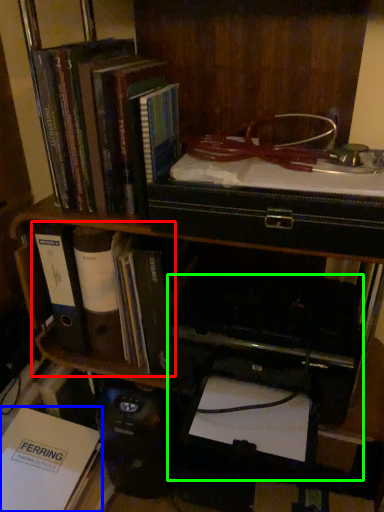
Question: Which object is positioned closest to book (highlighted by a red box)? Select from book (highlighted by a blue box) and printer (highlighted by a green box).

Choices:
 (A) book
 (B) printer

Answer: (B)